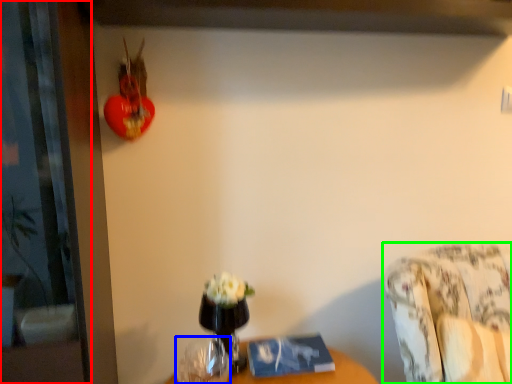
Question: Based on their relative distances, which object is farther from screen door (highlighted by a red box)? Choose from vase (highlighted by a blue box) and furniture (highlighted by a green box).

Choices:
 (A) vase
 (B) furniture

Answer: (B)